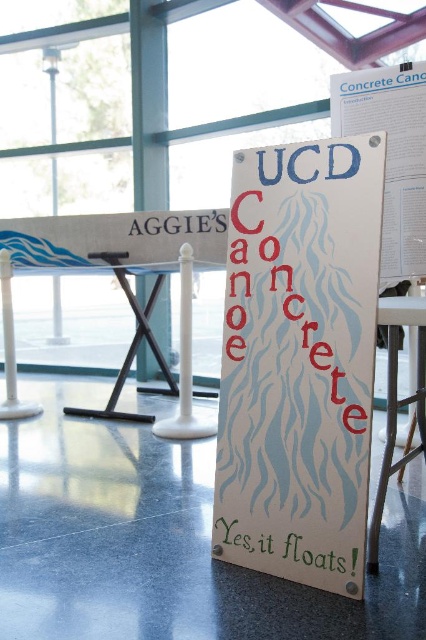
You are setting up a display in the conference room and need to place a 1.2 meter tall sculpture. The sculpture requires a surface that is at least 1 meter in height to be stable. Can the white glossy table at right or the green painted wood yes, it floats! at lower center accommodate it?

The white glossy table at right has a greater height compared to the green painted wood yes, it floats! at lower center. Therefore, the white glossy table at right can accommodate the 1.2 meter tall sculpture as it meets the height requirement, while the green painted wood yes, it floats! at lower center may not be suitable due to its shorter height.

In the scene shown: You are at a university event and need to place a heavy object on a surface. Which object, the white glossy table at right or the green painted wood yes, it floats! at lower center, would be more suitable for supporting weight based on their positions?

The white glossy table at right is closer to the viewer than the green painted wood yes, it floats! at lower center, so it is likely larger and sturdier, making it more suitable for supporting heavy objects.